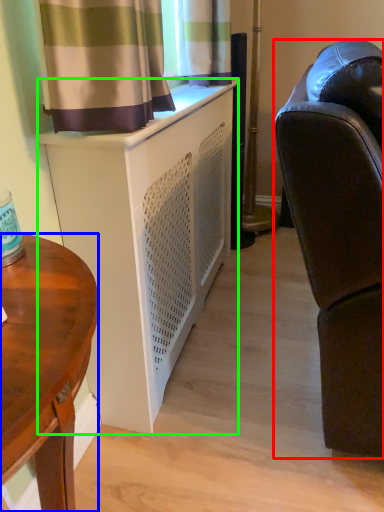
Question: Based on their relative distances, which object is nearer to studio couch (highlighted by a red box)? Choose from desk (highlighted by a blue box) and cabinetry (highlighted by a green box).

Choices:
 (A) desk
 (B) cabinetry

Answer: (B)